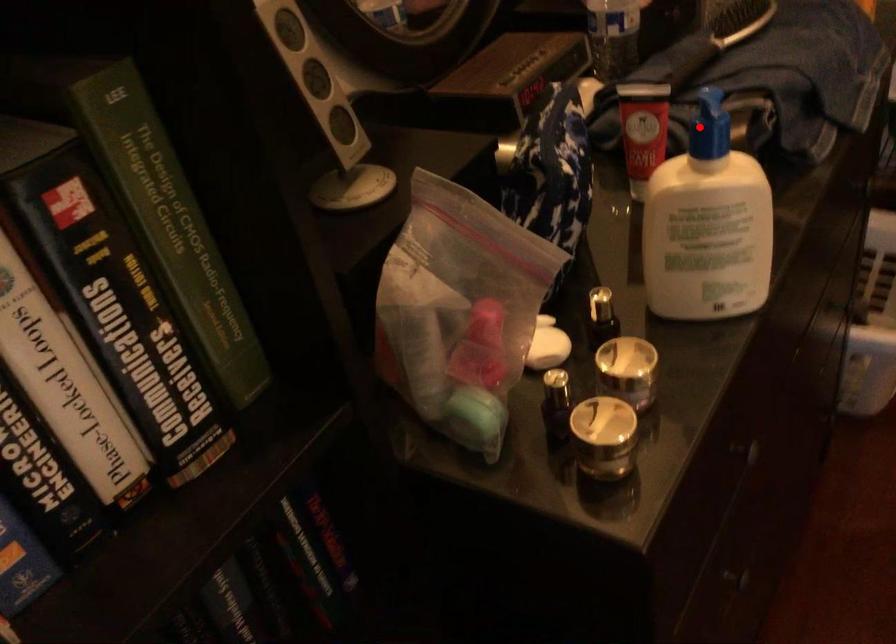
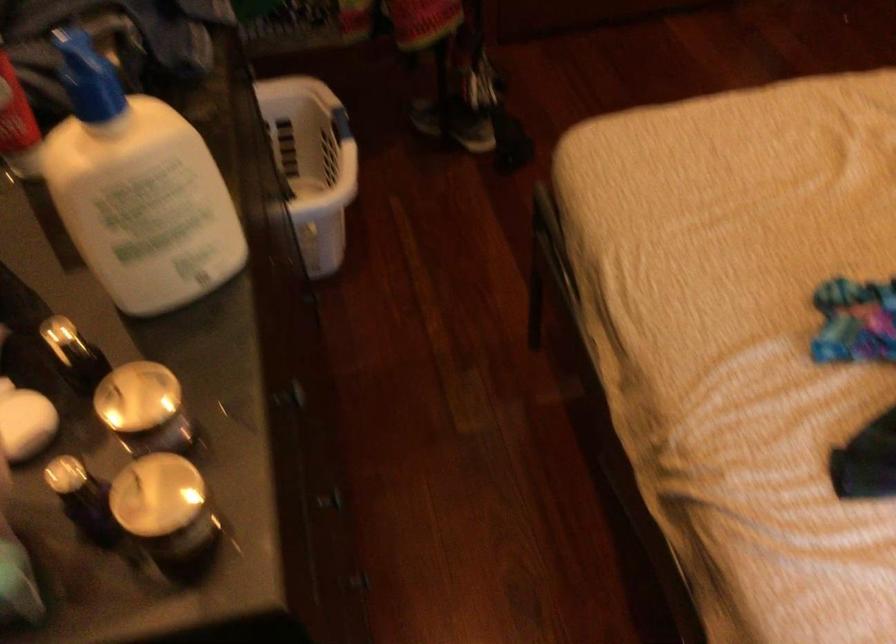
Question: I am providing you with two images of the same scene from different viewpoints. In image1, a red point is highlighted. Considering the same 3D point in image2, which of the following is correct?

Choices:
 (A) It is closer
 (B) It is farther

Answer: (A)